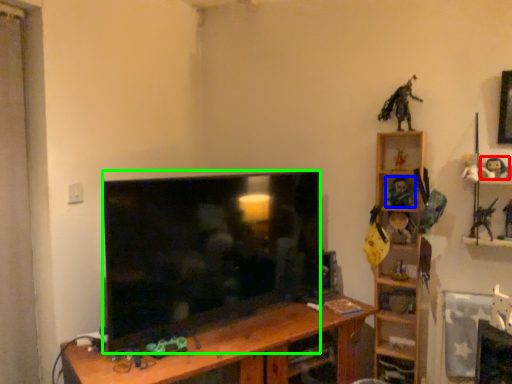
Question: Based on their relative distances, which object is nearer to toy (highlighted by a red box)? Choose from toy (highlighted by a blue box) and television (highlighted by a green box).

Choices:
 (A) toy
 (B) television

Answer: (A)